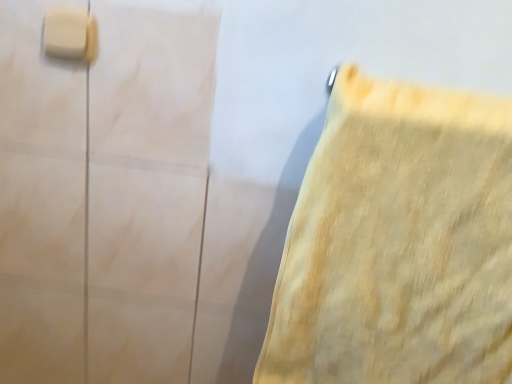
This screenshot has height=384, width=512. I want to click on yellow fabric towel at right, so click(398, 243).

This screenshot has width=512, height=384. Describe the element at coordinates (398, 243) in the screenshot. I see `yellow fabric towel at right` at that location.

Identify the location of white matte/light switch at upper left. The width and height of the screenshot is (512, 384). (69, 34).

What do you see at coordinates (69, 34) in the screenshot? This screenshot has height=384, width=512. I see `white matte/light switch at upper left` at bounding box center [69, 34].

In order to face white matte/light switch at upper left, should I rotate leftwards or rightwards?

Rotate your view left by about 23.708°.

The image size is (512, 384). I want to click on yellow fabric towel at right, so click(398, 243).

Is yellow fabric towel at right to the left or to the right of white matte/light switch at upper left in the image?

yellow fabric towel at right is positioned on white matte/light switch at upper left's right side.

Does yellow fabric towel at right come behind white matte/light switch at upper left?

No, the depth of yellow fabric towel at right is less than that of white matte/light switch at upper left.

Which is farther, (319,312) or (77,48)?

The point (77,48) is more distant.

From the image's perspective, is yellow fabric towel at right above or below white matte/light switch at upper left?

yellow fabric towel at right is situated lower than white matte/light switch at upper left in the image.

From a real-world perspective, does yellow fabric towel at right stand above white matte/light switch at upper left?

Incorrect, from a real-world perspective, yellow fabric towel at right is lower than white matte/light switch at upper left.

Which of these two, yellow fabric towel at right or white matte/light switch at upper left, is wider?

yellow fabric towel at right.

Does yellow fabric towel at right have a lesser height compared to white matte/light switch at upper left?

Incorrect, the height of yellow fabric towel at right does not fall short of that of white matte/light switch at upper left.

Can you confirm if yellow fabric towel at right is smaller than white matte/light switch at upper left?

No.

Is yellow fabric towel at right completely or partially outside of white matte/light switch at upper left?

Yes, yellow fabric towel at right is located beyond the bounds of white matte/light switch at upper left.

Is yellow fabric towel at right positioned far away from white matte/light switch at upper left?

No, yellow fabric towel at right is in close proximity to white matte/light switch at upper left.

Is yellow fabric towel at right positioned with its back to white matte/light switch at upper left?

No, yellow fabric towel at right is not facing away from white matte/light switch at upper left.

How different are the orientations of yellow fabric towel at right and white matte/light switch at upper left in degrees?

The angle between the facing direction of yellow fabric towel at right and the facing direction of white matte/light switch at upper left is 0.0104 degrees.

Measure the distance from yellow fabric towel at right to white matte/light switch at upper left.

54.29 centimeters.

The image size is (512, 384). I want to click on light switch that is behind the yellow fabric towel at right, so click(69, 34).

Is white matte/light switch at upper left at the right side of yellow fabric towel at right?

No.

Considering the positions of objects white matte/light switch at upper left and yellow fabric towel at right in the image provided, who is behind, white matte/light switch at upper left or yellow fabric towel at right?

white matte/light switch at upper left is further from the camera.

Considering the positions of point (93, 20) and point (411, 277), is point (93, 20) closer or farther from the camera than point (411, 277)?

Point (93, 20).

From the image's perspective, is white matte/light switch at upper left positioned above or below yellow fabric towel at right?

white matte/light switch at upper left is above yellow fabric towel at right.

From a real-world perspective, is white matte/light switch at upper left on yellow fabric towel at right?

Indeed, from a real-world perspective, white matte/light switch at upper left stands above yellow fabric towel at right.

Does white matte/light switch at upper left have a greater width compared to yellow fabric towel at right?

Incorrect, the width of white matte/light switch at upper left does not surpass that of yellow fabric towel at right.

Can you confirm if white matte/light switch at upper left is shorter than yellow fabric towel at right?

Indeed, white matte/light switch at upper left has a lesser height compared to yellow fabric towel at right.

Who is bigger, white matte/light switch at upper left or yellow fabric towel at right?

yellow fabric towel at right is bigger.

Do you think white matte/light switch at upper left is within yellow fabric towel at right, or outside of it?

white matte/light switch at upper left is spatially situated outside yellow fabric towel at right.

Is white matte/light switch at upper left far away from yellow fabric towel at right?

No, white matte/light switch at upper left is not far from yellow fabric towel at right.

Could you tell me if white matte/light switch at upper left is facing yellow fabric towel at right?

No, white matte/light switch at upper left is not turned towards yellow fabric towel at right.

The width and height of the screenshot is (512, 384). I want to click on towel on the right of white matte/light switch at upper left, so click(398, 243).

I want to click on light switch above the yellow fabric towel at right (from the image's perspective), so click(x=69, y=34).

Locate an element on the screen. The width and height of the screenshot is (512, 384). light switch behind the yellow fabric towel at right is located at coordinates (69, 34).